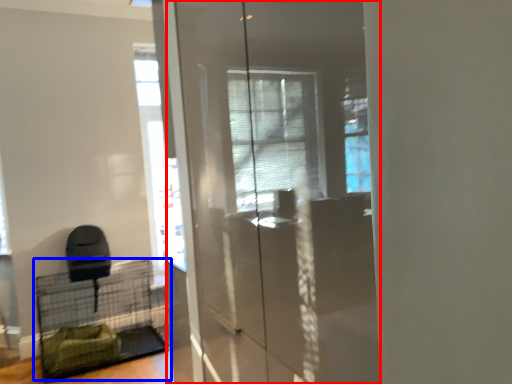
Question: Among these objects, which one is farthest to the camera, screen door (highlighted by a red box) or bird cage (highlighted by a blue box)?

Choices:
 (A) screen door
 (B) bird cage

Answer: (B)